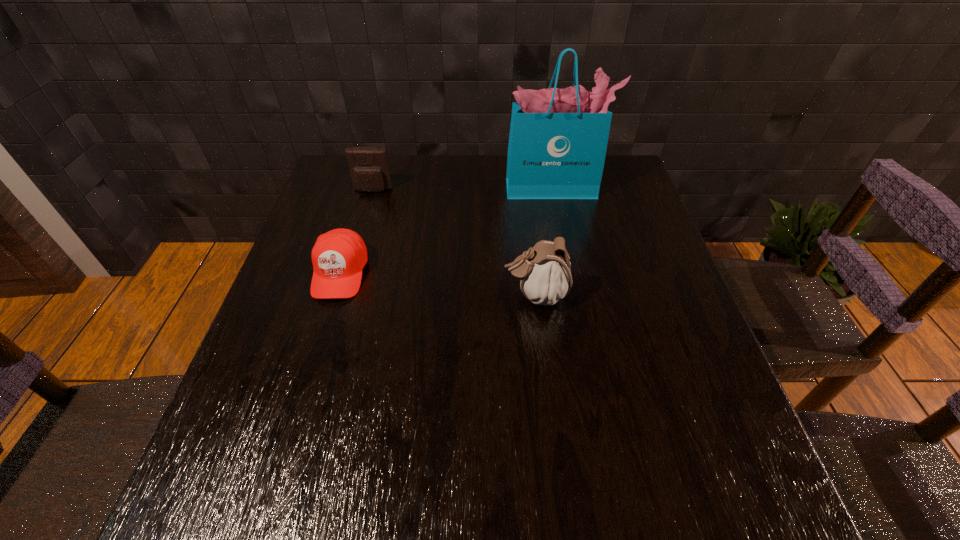
Find the location of a particular element. free point between the baseball cap and the taller pouch is located at coordinates (438, 284).

Find the location of a particular element. Image resolution: width=960 pixels, height=540 pixels. empty space between the tallest object and the shorter pouch is located at coordinates (463, 190).

You are a GUI agent. You are given a task and a screenshot of the screen. Output one action in this format:
    pyautogui.click(x=<x>, y=<y>)
    Task: Click on the free spot between the baseball cap and the left pouch
    Image resolution: width=960 pixels, height=540 pixels.
    Given the screenshot: What is the action you would take?
    pyautogui.click(x=356, y=232)

Identify the location of free area in between the baseball cap and the second tallest object. (438, 284).

Locate an element on the screen. This screenshot has height=540, width=960. object that is the closest to the shopping bag is located at coordinates (545, 277).

Locate which object is the second closest to the shopping bag. Please provide its 2D coordinates. Your answer should be formatted as a tuple, i.e. [(x, y)], where the tuple contains the x and y coordinates of a point satisfying the conditions above.

[(369, 168)]